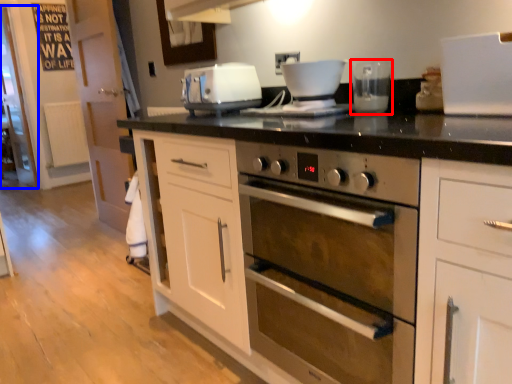
Question: Which object appears farthest to the camera in this image, coffee machine (highlighted by a red box) or glass door (highlighted by a blue box)?

Choices:
 (A) coffee machine
 (B) glass door

Answer: (B)